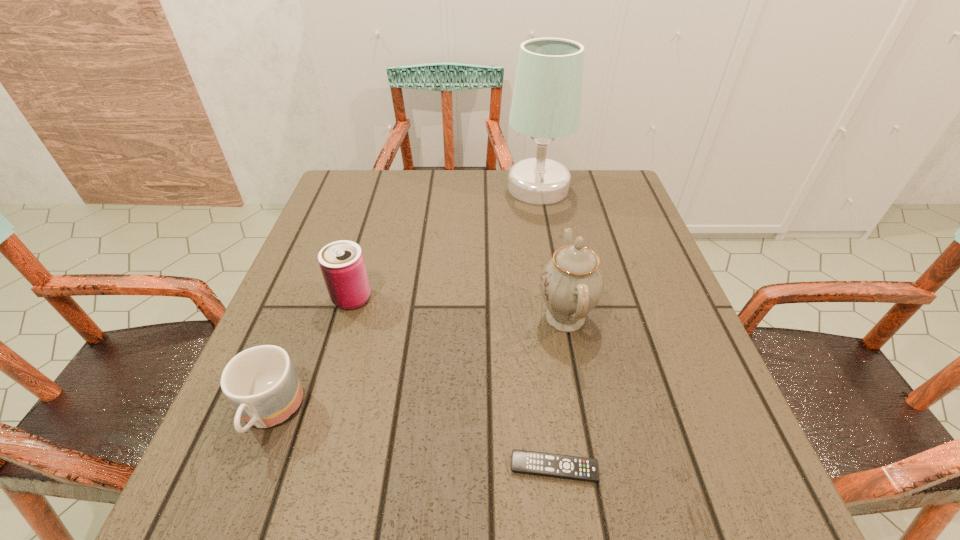
Find the location of a particular element. This screenshot has width=960, height=540. vacant space in between the fourth tallest object and the third tallest object is located at coordinates (311, 356).

Locate an element on the screen. empty location between the shortest object and the lampshade is located at coordinates (546, 328).

This screenshot has width=960, height=540. I want to click on free space between the remote control and the tallest object, so click(x=546, y=328).

At what (x,y) coordinates should I click in order to perform the action: click on vacant space that's between the fourth shortest object and the shortest object. Please return your answer as a coordinate pair (x, y). The height and width of the screenshot is (540, 960). Looking at the image, I should click on (560, 393).

This screenshot has height=540, width=960. What are the coordinates of `free space between the remote control and the third tallest object` in the screenshot? It's located at (453, 383).

Identify the location of unoccupied position between the fourth shortest object and the third tallest object. This screenshot has height=540, width=960. (459, 308).

Where is `empty space that is in between the mug and the second tallest object`? The image size is (960, 540). empty space that is in between the mug and the second tallest object is located at coordinates [x=418, y=366].

In order to click on free space that is in between the third shortest object and the fourth tallest object in this screenshot , I will do `click(311, 356)`.

This screenshot has height=540, width=960. What are the coordinates of `free space between the third shortest object and the second shortest object` in the screenshot? It's located at (311, 356).

Identify which object is located as the third nearest to the mug. Please provide its 2D coordinates. Your answer should be formatted as a tuple, i.e. [(x, y)], where the tuple contains the x and y coordinates of a point satisfying the conditions above.

[(571, 283)]